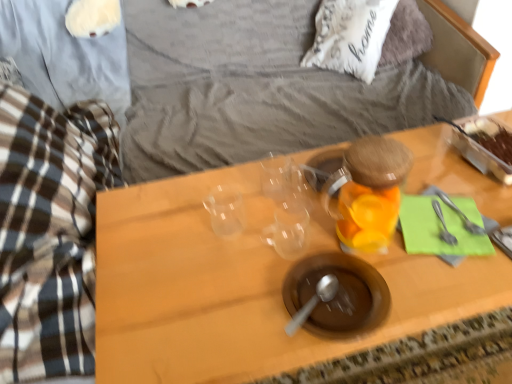
This screenshot has height=384, width=512. Find the location of `empty space that is to the right of silver metallic fork at right, which is the second silverware in right-to-left order`. empty space that is to the right of silver metallic fork at right, which is the second silverware in right-to-left order is located at coordinates (486, 209).